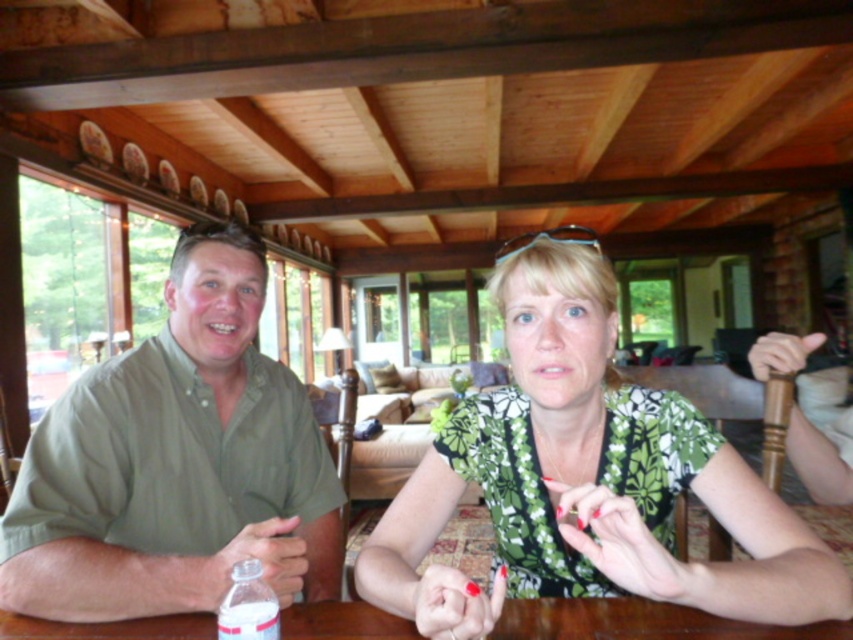
Consider the image. Can you confirm if green floral blouse at center is smaller than white plastic bottle at lower left?

Actually, green floral blouse at center might be larger than white plastic bottle at lower left.

Between green floral blouse at center and white plastic bottle at lower left, which one is positioned lower?

white plastic bottle at lower left

In the scene shown: Who is more distant from viewer, (642, 493) or (242, 582)?

The point (642, 493) is more distant.

You are a GUI agent. You are given a task and a screenshot of the screen. Output one action in this format:
    pyautogui.click(x=<x>, y=<y>)
    Task: Click on the green floral blouse at center
    Image resolution: width=853 pixels, height=640 pixels.
    Given the screenshot: What is the action you would take?
    [585, 477]

Is green cotton shirt at left positioned before white plastic bottle at lower left?

No.

Does green cotton shirt at left have a lesser height compared to white plastic bottle at lower left?

No.

Where is `green cotton shirt at left`? This screenshot has height=640, width=853. green cotton shirt at left is located at coordinates (177, 464).

The height and width of the screenshot is (640, 853). What do you see at coordinates (177, 464) in the screenshot? I see `green cotton shirt at left` at bounding box center [177, 464].

Which is behind, point (41, 504) or point (619, 616)?

The point (41, 504) is more distant.

At what (x,y) coordinates should I click in order to perform the action: click on green cotton shirt at left. Please return your answer as a coordinate pair (x, y). This screenshot has height=640, width=853. Looking at the image, I should click on (177, 464).